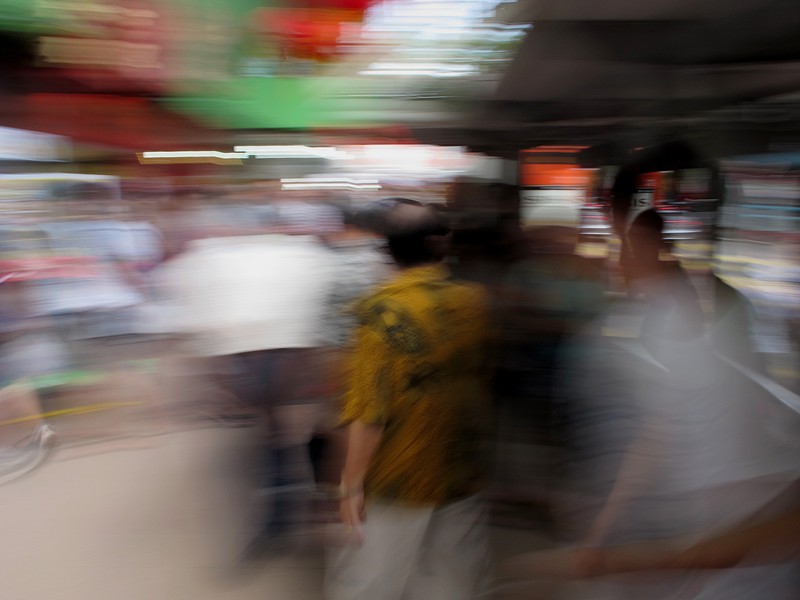
You are a GUI agent. You are given a task and a screenshot of the screen. Output one action in this format:
    pyautogui.click(x=<x>, y=<y>)
    Task: Click on the beige floor
    The image size is (800, 600).
    Given the screenshot: What is the action you would take?
    pyautogui.click(x=94, y=531)